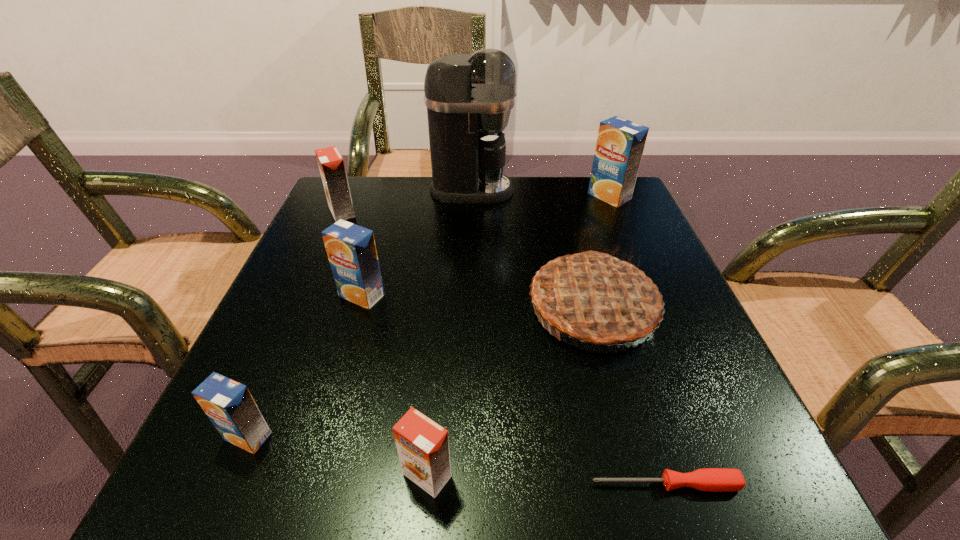
Find the location of a particular element. the smaller orange orange juice is located at coordinates (423, 446).

The width and height of the screenshot is (960, 540). I want to click on the second orange juice from right to left, so click(423, 446).

This screenshot has width=960, height=540. In order to click on the shortest object in this screenshot , I will do `click(708, 479)`.

You are a GUI agent. You are given a task and a screenshot of the screen. Output one action in this format:
    pyautogui.click(x=<x>, y=<y>)
    Task: Click on the blank space located 0.060m place cup under the spout of the coffee maker
    This screenshot has height=540, width=960.
    Given the screenshot: What is the action you would take?
    pyautogui.click(x=538, y=190)

Where is `vacant region located 0.360m on the left of the tallest orange juice`? This screenshot has width=960, height=540. vacant region located 0.360m on the left of the tallest orange juice is located at coordinates (442, 197).

Locate an element on the screen. This screenshot has height=540, width=960. vacant point located 0.120m on the left of the pie is located at coordinates (461, 307).

You are a GUI agent. You are given a task and a screenshot of the screen. Output one action in this format:
    pyautogui.click(x=<x>, y=<y>)
    Task: Click on the vacant space located on the front of the left orange orange juice
    The image size is (960, 540).
    Given the screenshot: What is the action you would take?
    pyautogui.click(x=282, y=350)

The image size is (960, 540). I want to click on vacant position located on the right of the third orange juice from right to left, so click(412, 295).

You are a GUI agent. You are given a task and a screenshot of the screen. Output one action in this format:
    pyautogui.click(x=<x>, y=<y>)
    Task: Click on the vacant space positioned 0.310m on the right of the smallest blue orange_juice
    
    Given the screenshot: What is the action you would take?
    (498, 436)

The image size is (960, 540). Identify the location of free space located 0.140m on the right of the right orange orange juice. (562, 475).